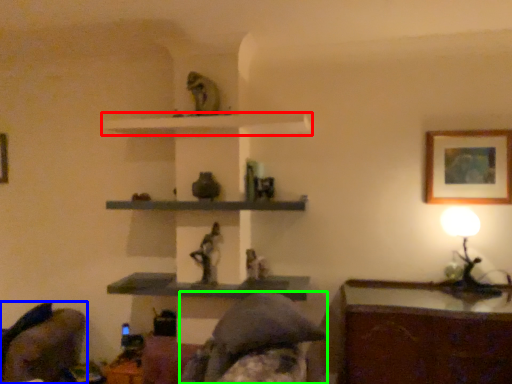
Question: Considering the real-world distances, which object is closest to shelf (highlighted by a red box)? swivel chair (highlighted by a blue box) or person (highlighted by a green box).

Choices:
 (A) swivel chair
 (B) person

Answer: (B)